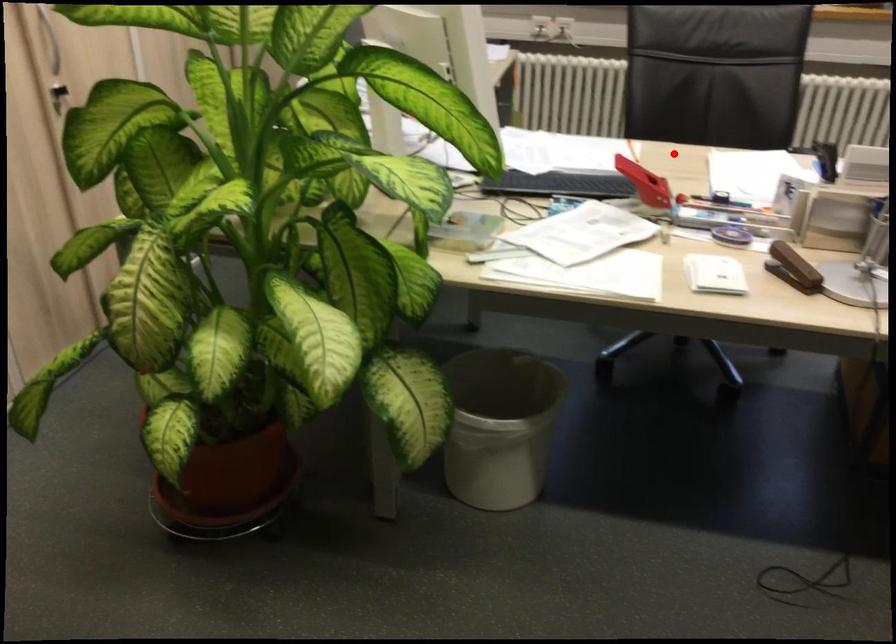
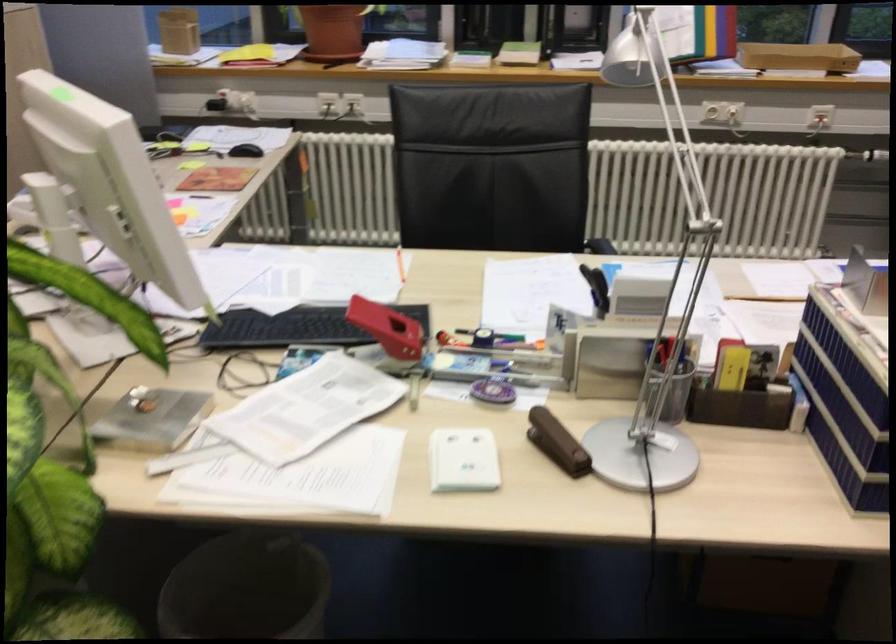
Question: I am providing you with two images of the same scene from different viewpoints. Given a red point in image1, look at the same physical point in image2. Is it:

Choices:
 (A) Closer to the viewpoint
 (B) Farther from the viewpoint

Answer: (A)